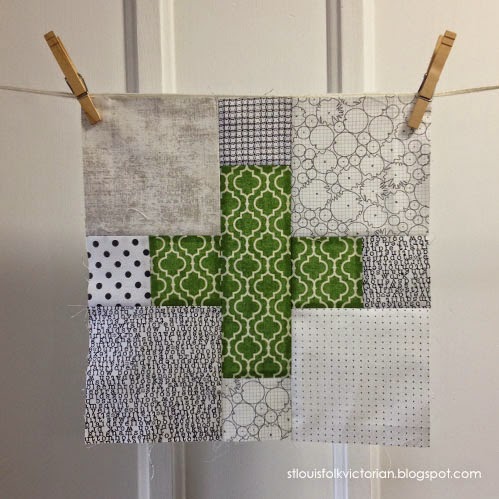
Locate an element on the screen. This screenshot has width=499, height=499. door is located at coordinates (253, 471).